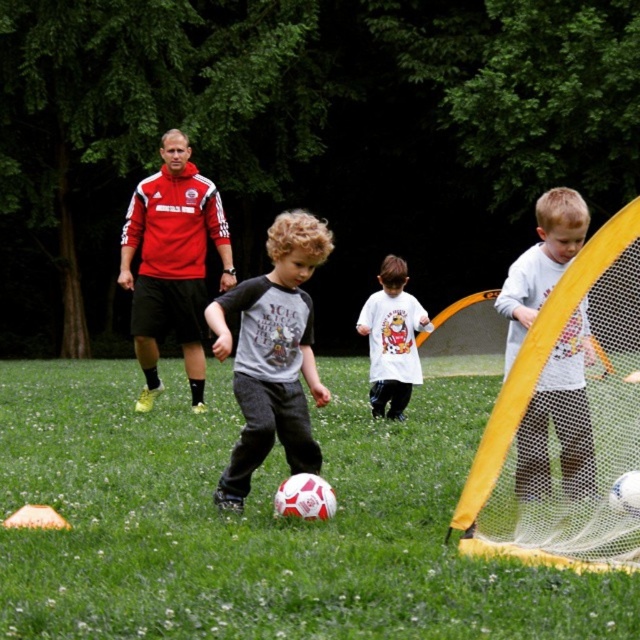
Question: Which of the following is the closest to the observer?

Choices:
 (A) (330, 243)
 (B) (188, 372)
 (C) (531, 428)

Answer: (C)

Question: Which point appears farthest from the camera in this image?

Choices:
 (A) (220, 237)
 (B) (12, 547)

Answer: (A)

Question: Can you confirm if white matte soccer ball at center is positioned above white matte t-shirt at center?

Choices:
 (A) no
 (B) yes

Answer: (A)

Question: Which object appears closest to the camera in this image?

Choices:
 (A) matte red hoodie at center
 (B) white matte soccer ball at center
 (C) white matte t-shirt at center

Answer: (B)

Question: In this image, where is white matte soccer ball at center located relative to gray cotton shirt at center?

Choices:
 (A) below
 (B) above

Answer: (A)

Question: Observing the image, what is the correct spatial positioning of white matte soccer ball at center in reference to white matte t-shirt at center?

Choices:
 (A) above
 (B) below

Answer: (B)